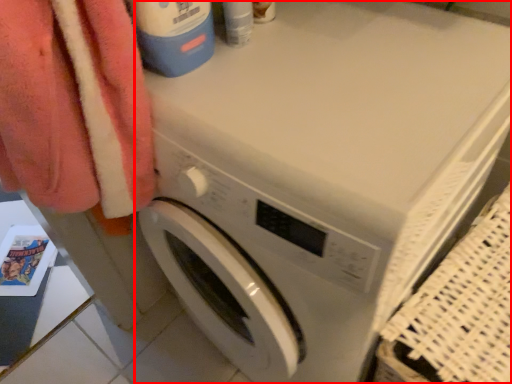
Question: Where is washing machine (annotated by the red box) located in relation to cleaning product in the image?

Choices:
 (A) right
 (B) left

Answer: (A)